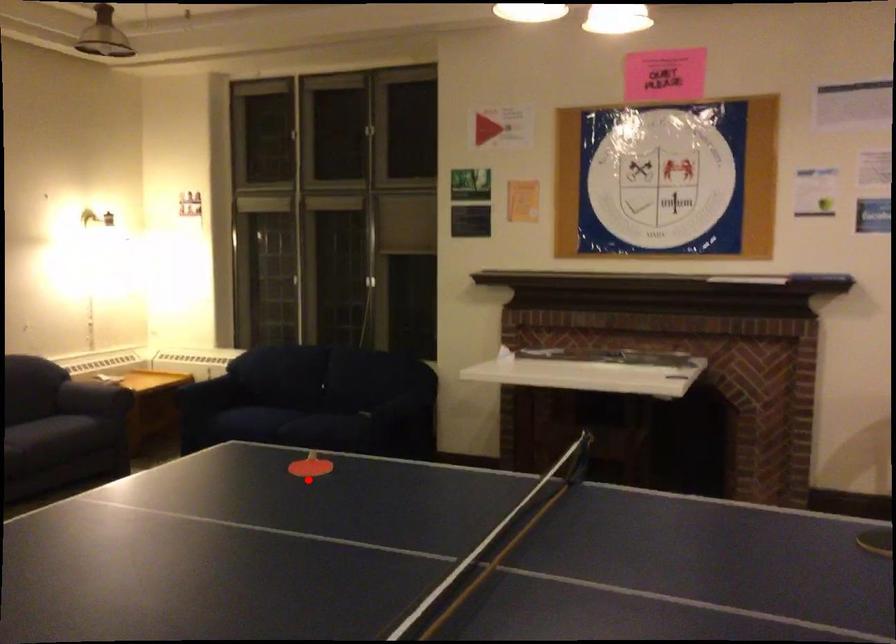
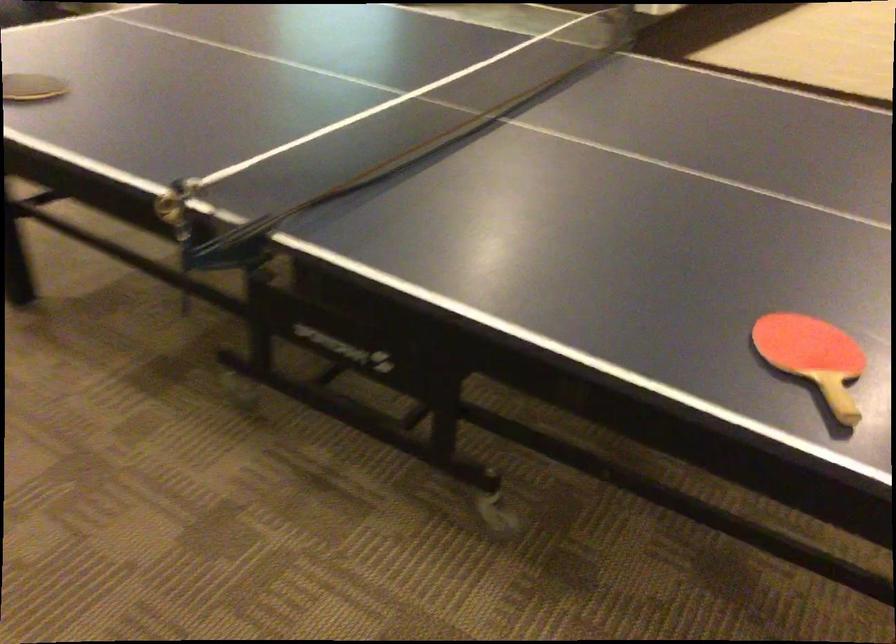
Question: I am providing you with two images of the same scene from different viewpoints. A red point is shown in image1. For the corresponding object point in image2, is it positioned nearer or farther from the camera?

Choices:
 (A) Nearer
 (B) Farther

Answer: (A)